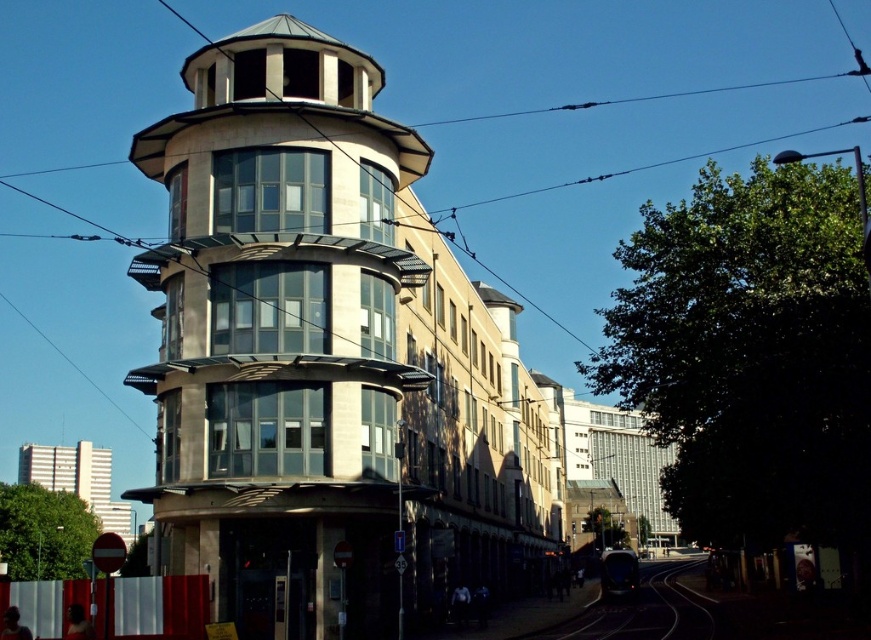
Is matte glass bell tower at center above black asphalt train track at lower center?

Yes, matte glass bell tower at center is above black asphalt train track at lower center.

Who is more distant from viewer, (341, 124) or (612, 637)?

The point (612, 637) is behind.

Locate an element on the screen. matte glass bell tower at center is located at coordinates (280, 332).

Locate an element on the screen. The width and height of the screenshot is (871, 640). matte glass bell tower at center is located at coordinates (280, 332).